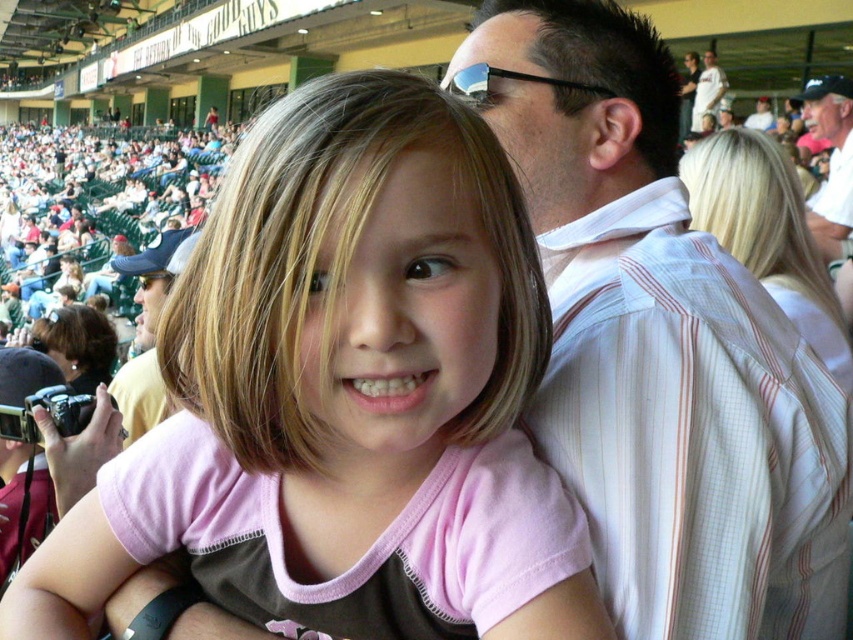
Is matte green seats at upper left wider than white pinstriped shirt at upper right?

Yes, matte green seats at upper left is wider than white pinstriped shirt at upper right.

Is matte green seats at upper left smaller than white pinstriped shirt at upper right?

Incorrect, matte green seats at upper left is not smaller in size than white pinstriped shirt at upper right.

Which is in front, point (103, 182) or point (842, 104)?

Point (842, 104) is more forward.

Identify the location of matte green seats at upper left. This screenshot has height=640, width=853. (97, 205).

Between matte green seats at upper left and matte white shirt at center, which one appears on the left side from the viewer's perspective?

matte green seats at upper left

Does matte green seats at upper left appear over matte white shirt at center?

Yes, matte green seats at upper left is above matte white shirt at center.

Is point (91, 205) closer to viewer compared to point (178, 244)?

No, it is behind (178, 244).

At what (x,y) coordinates should I click in order to perform the action: click on matte green seats at upper left. Please return your answer as a coordinate pair (x, y). Image resolution: width=853 pixels, height=640 pixels. Looking at the image, I should click on (97, 205).

Who is more distant from viewer, (171, 280) or (708, 52)?

Positioned behind is point (708, 52).

The width and height of the screenshot is (853, 640). I want to click on matte white shirt at center, so click(x=148, y=332).

Where is `matte white shirt at center`? The image size is (853, 640). matte white shirt at center is located at coordinates (148, 332).